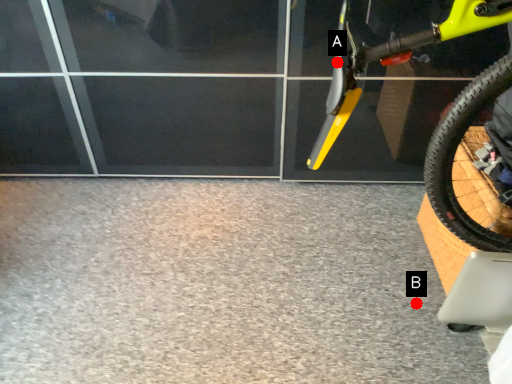
Question: Two points are circled on the image, labeled by A and B beside each circle. Which of the following is the closest to the observer?

Choices:
 (A) A is closer
 (B) B is closer

Answer: (A)